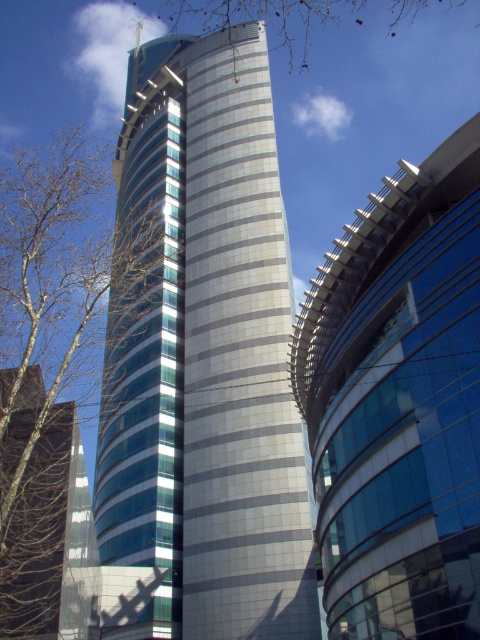
Question: Does silver metallic tower at center appear under brown leafless tree at upper left?

Choices:
 (A) yes
 (B) no

Answer: (A)

Question: Which object is closer to the camera taking this photo?

Choices:
 (A) bare branches at left
 (B) glassy reflective building at center
 (C) silver metallic tower at center

Answer: (B)

Question: Does glassy reflective building at center appear on the right side of brown leafless tree at upper left?

Choices:
 (A) no
 (B) yes

Answer: (A)

Question: Estimate the real-world distances between objects in this image. Which object is farther from the silver metallic tower at center?

Choices:
 (A) bare branches at left
 (B) brown leafless tree at upper left

Answer: (B)

Question: Where is glassy reflective building at center located in relation to brown leafless tree at upper left in the image?

Choices:
 (A) left
 (B) right

Answer: (A)

Question: Which point appears farthest from the camera in this image?

Choices:
 (A) pyautogui.click(x=288, y=308)
 (B) pyautogui.click(x=363, y=269)
 (C) pyautogui.click(x=48, y=253)

Answer: (C)